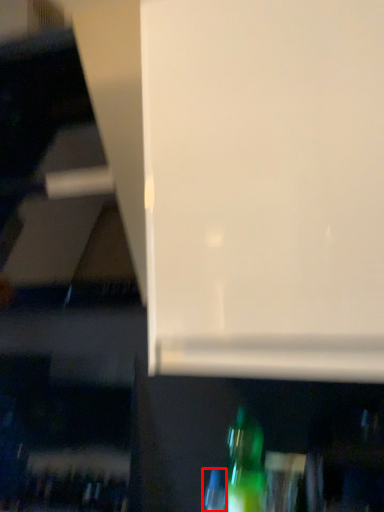
Question: Observing the image, what is the correct spatial positioning of bottle (annotated by the red box) in reference to bottle?

Choices:
 (A) left
 (B) right

Answer: (A)